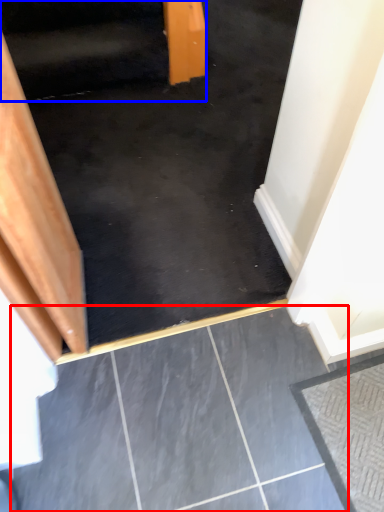
Question: Which of the following is the closest to the observer, concrete (highlighted by a red box) or stairwell (highlighted by a blue box)?

Choices:
 (A) concrete
 (B) stairwell

Answer: (A)